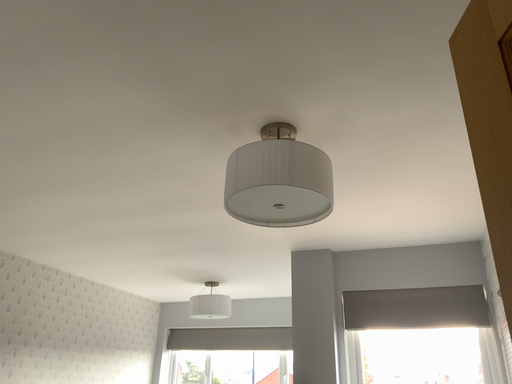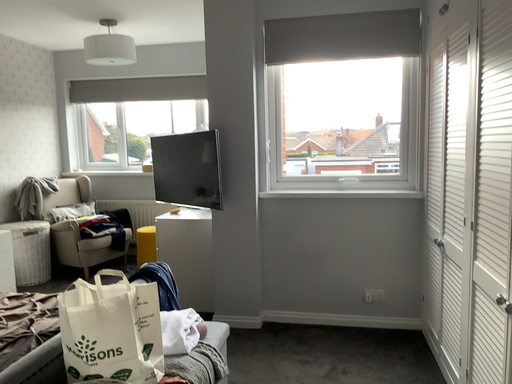
Question: Which way did the camera rotate in the video?

Choices:
 (A) rotated upward
 (B) rotated downward

Answer: (B)